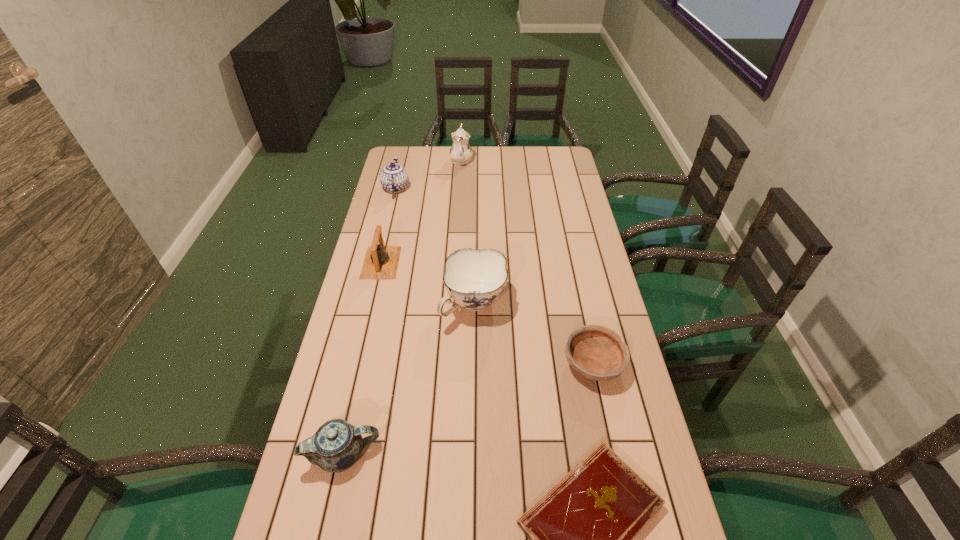
This screenshot has width=960, height=540. In order to click on vacant space at the right edge of the desktop in this screenshot , I will do `click(589, 381)`.

This screenshot has height=540, width=960. In order to click on free location at the far right corner of the desktop in this screenshot , I will do `click(557, 167)`.

Find the location of `free space between the nearest chinaware and the second shortest object`. free space between the nearest chinaware and the second shortest object is located at coordinates (468, 409).

What are the coordinates of `unoccupied position between the nearest chinaware and the bell` in the screenshot? It's located at (362, 359).

Identify the location of vacant area that lies between the nearest chinaware and the farthest object. The width and height of the screenshot is (960, 540). (402, 307).

At what (x,y) coordinates should I click in order to perform the action: click on blank region between the third farthest chinaware and the second farthest chinaware. Please return your answer as a coordinate pair (x, y). The width and height of the screenshot is (960, 540). Looking at the image, I should click on (435, 246).

The height and width of the screenshot is (540, 960). I want to click on vacant space that's between the bell and the second farthest chinaware, so click(x=389, y=225).

I want to click on vacant area that lies between the third farthest chinaware and the nearest chinaware, so (x=409, y=379).

Where is `empty space between the second farthest chinaware and the nearest chinaware`? The image size is (960, 540). empty space between the second farthest chinaware and the nearest chinaware is located at coordinates (370, 321).

At what (x,y) coordinates should I click in order to perform the action: click on object that stands as the third closest to the bell. Please return your answer as a coordinate pair (x, y). This screenshot has width=960, height=540. Looking at the image, I should click on (336, 446).